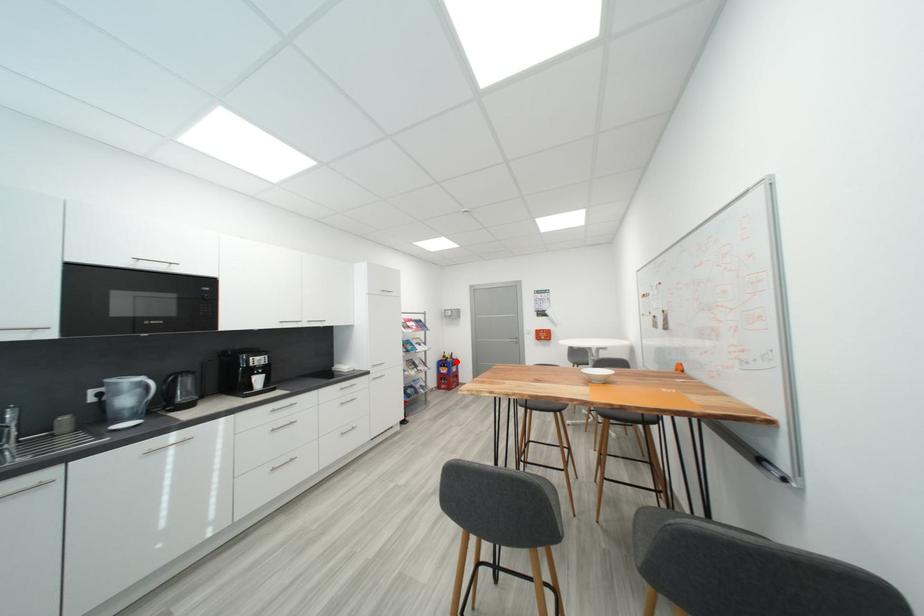
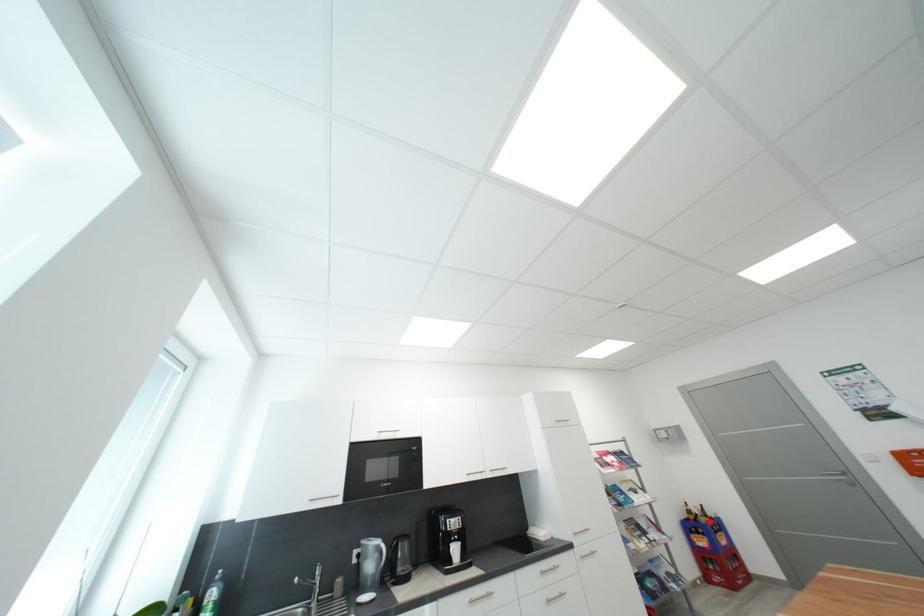
I am providing you with two images of the same scene from different viewpoints. A red point is marked on the first image and another point is marked on the second image. Do the highlighted points in image1 and image2 indicate the same real-world spot?

Yes